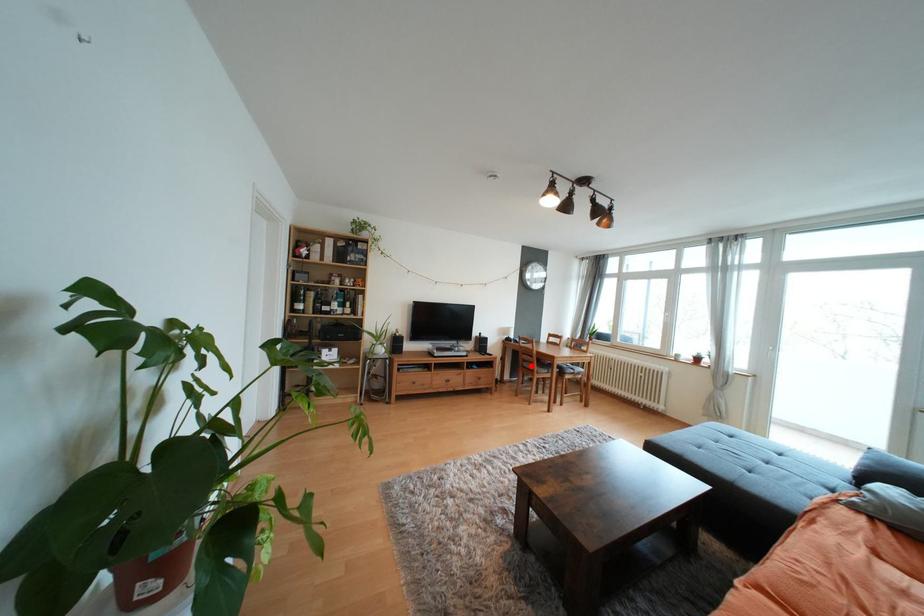
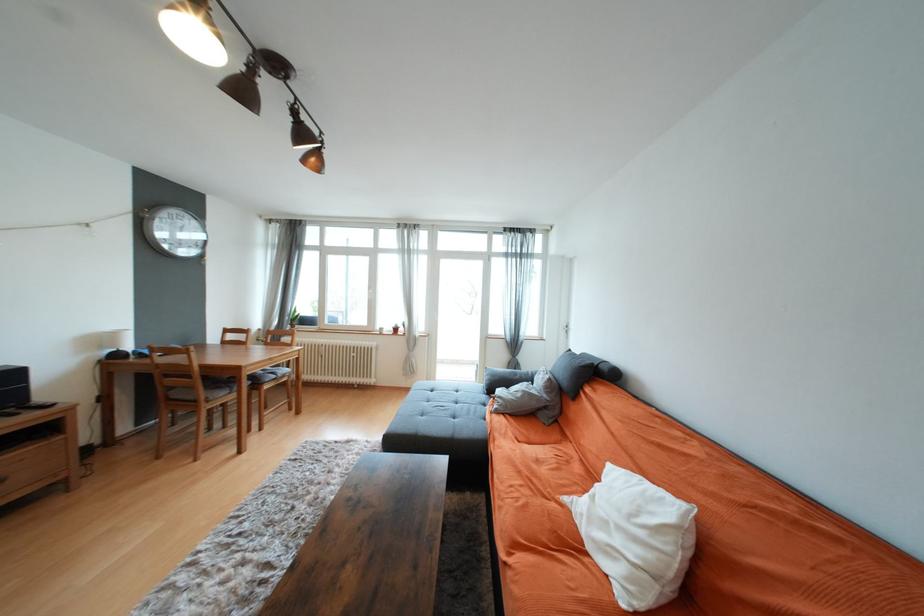
Locate, in the second image, the point that corresponds to the highlighted location in the first image.

(181, 395)